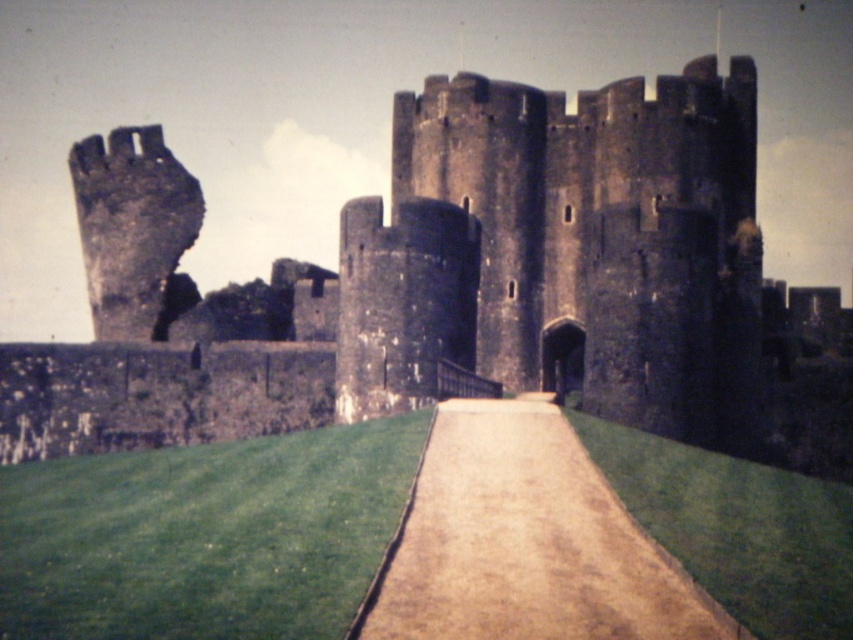
You are a knight approaching the castle and notice the green grass at lower left and the brown gravel path at center. Which direction should you walk to stay on the path?

To stay on the brown gravel path at center, you should walk to the right of the green grass at lower left since the green grass at lower left is located to the left of the path.

You are standing at the entrance of the medieval castle and notice two points marked on the pathway leading up to the castle. The first point is at coordinates point (x=532, y=332) and the second is at point (x=508, y=589). Which point is closer to you as you stand at the entrance?

Point (x=532, y=332) is closer to you because it is further to the viewer than point (x=508, y=589), meaning it is positioned nearer to your current location at the entrance.

You are standing at the point marked by coordinates (465, 285) in the image of the medieval castle. What structure are you directly positioned at?

The point marked by coordinates (465, 285) corresponds to the dark stone castle at center, so you are directly positioned at the dark stone castle at center.